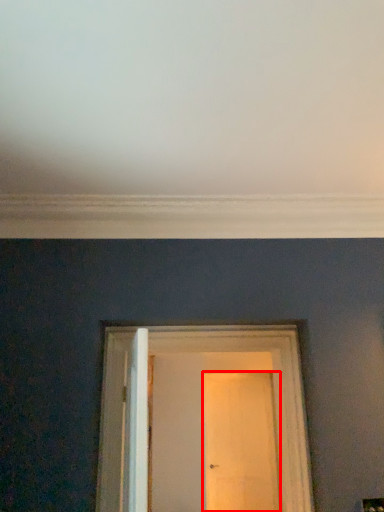
Question: From the image's perspective, what is the correct spatial positioning of door (annotated by the red box) in reference to door?

Choices:
 (A) below
 (B) above

Answer: (A)